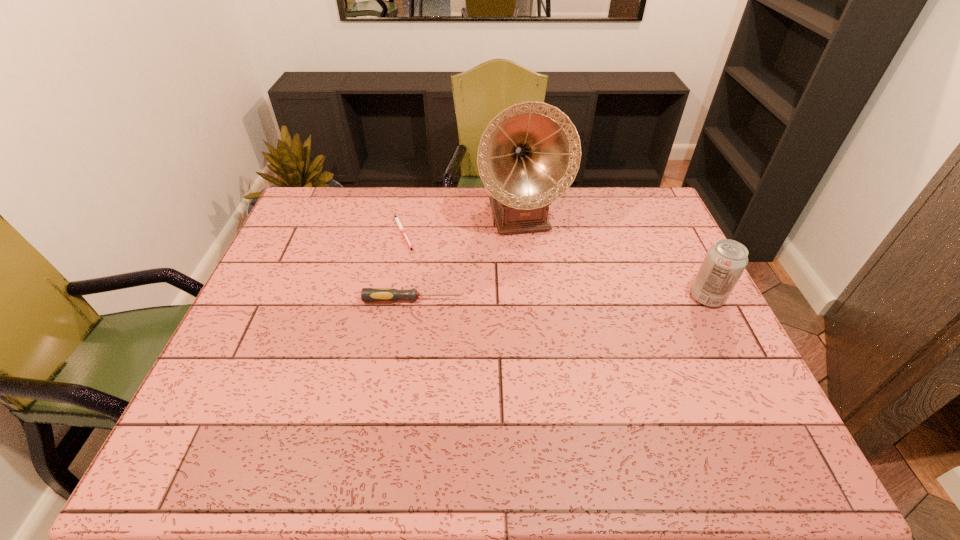
Find the location of a particular element. vacant region at the right edge of the desktop is located at coordinates [x=704, y=339].

You are a GUI agent. You are given a task and a screenshot of the screen. Output one action in this format:
    pyautogui.click(x=<x>, y=<y>)
    Task: Click on the free space between the pen and the second object from right to left
    The height and width of the screenshot is (540, 960).
    Given the screenshot: What is the action you would take?
    pyautogui.click(x=463, y=225)

Where is `unoccupied area between the third object from left to right and the pen`? unoccupied area between the third object from left to right and the pen is located at coordinates (463, 225).

At what (x,y) coordinates should I click in order to perform the action: click on blank region between the second shortest object and the soda can. Please return your answer as a coordinate pair (x, y). The image size is (960, 540). Looking at the image, I should click on (561, 299).

Where is `empty space that is in between the pen and the screwdriver`? empty space that is in between the pen and the screwdriver is located at coordinates coord(408,266).

Identify the location of vacant area that lies between the pen and the soda can. (555, 265).

Find the location of a particular element. This screenshot has height=540, width=960. empty location between the third shortest object and the shortest object is located at coordinates (555, 265).

The width and height of the screenshot is (960, 540). Identify the location of free spot between the shortest object and the rightmost object. (555, 265).

Locate an element on the screen. Image resolution: width=960 pixels, height=540 pixels. free space between the shortest object and the screwdriver is located at coordinates (408, 266).

Find the location of `free point between the shortest object and the second tallest object`. free point between the shortest object and the second tallest object is located at coordinates (555, 265).